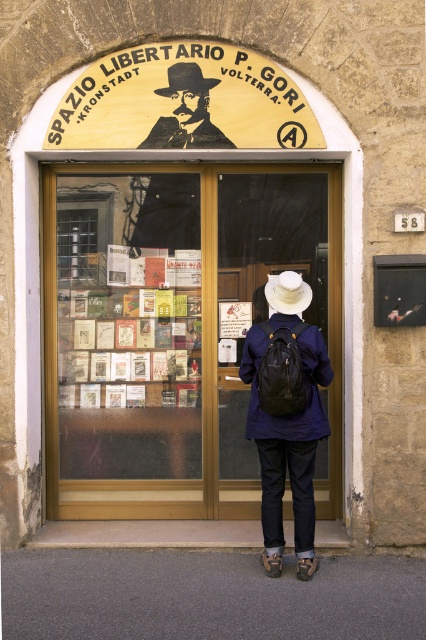
Can you confirm if transparent glass door at center is positioned to the left of dark blue fabric jacket at center?

Correct, you'll find transparent glass door at center to the left of dark blue fabric jacket at center.

Based on the photo, is transparent glass door at center smaller than dark blue fabric jacket at center?

No, transparent glass door at center is not smaller than dark blue fabric jacket at center.

Where is `transparent glass door at center`? The image size is (426, 640). transparent glass door at center is located at coordinates (175, 330).

Is matte black suit at upper center closer to camera compared to black matte portrait at center?

No, it is not.

Can you confirm if matte black suit at upper center is wider than black matte portrait at center?

In fact, matte black suit at upper center might be narrower than black matte portrait at center.

Does point (158, 237) lie in front of point (201, 124)?

That is False.

Identify the location of matte black suit at upper center. Image resolution: width=426 pixels, height=640 pixels. (187, 113).

Can you confirm if transparent glass door at center is taller than matte blue jacket at center?

Yes.

Is point (226, 237) farther from camera compared to point (287, 436)?

Yes, point (226, 237) is behind point (287, 436).

In order to click on transparent glass door at center in this screenshot , I will do `click(175, 330)`.

I want to click on transparent glass door at center, so click(175, 330).